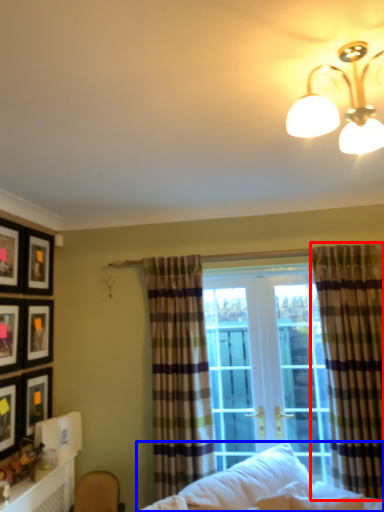
Question: Which object appears farthest to the camera in this image, curtain (highlighted by a red box) or studio couch (highlighted by a blue box)?

Choices:
 (A) curtain
 (B) studio couch

Answer: (A)